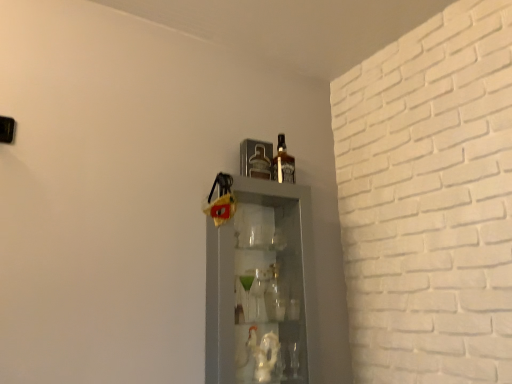
The width and height of the screenshot is (512, 384). Describe the element at coordinates (283, 163) in the screenshot. I see `brown glass bottle at upper center` at that location.

Find the location of `brown glass bottle at upper center`. brown glass bottle at upper center is located at coordinates (283, 163).

Measure the distance between point (291,166) and camera.

The distance of point (291,166) from camera is 5.89 feet.

What do you see at coordinates (259, 283) in the screenshot? I see `clear glass cabinet at center` at bounding box center [259, 283].

Identify the location of clear glass cabinet at center. (259, 283).

Locate an element on the screen. This screenshot has width=512, height=384. brown glass bottle at upper center is located at coordinates (283, 163).

Is clear glass cabinet at center to the left or to the right of brown glass bottle at upper center in the image?

In the image, clear glass cabinet at center appears on the left side of brown glass bottle at upper center.

Who is more distant, clear glass cabinet at center or brown glass bottle at upper center?

brown glass bottle at upper center.

Which is in front, point (219, 277) or point (280, 161)?

The point (219, 277) is more forward.

From the image's perspective, is clear glass cabinet at center under brown glass bottle at upper center?

Indeed, from the image's perspective, clear glass cabinet at center is shown beneath brown glass bottle at upper center.

From a real-world perspective, which object stands above the other?

From a 3D spatial view, brown glass bottle at upper center is above.

Does clear glass cabinet at center have a greater width compared to brown glass bottle at upper center?

Yes, clear glass cabinet at center is wider than brown glass bottle at upper center.

Does clear glass cabinet at center have a lesser height compared to brown glass bottle at upper center?

In fact, clear glass cabinet at center may be taller than brown glass bottle at upper center.

Which of these two, clear glass cabinet at center or brown glass bottle at upper center, is smaller?

brown glass bottle at upper center is smaller.

Can we say clear glass cabinet at center lies outside brown glass bottle at upper center?

Yes, clear glass cabinet at center is outside of brown glass bottle at upper center.

Can you see clear glass cabinet at center touching brown glass bottle at upper center?

No, clear glass cabinet at center is not in contact with brown glass bottle at upper center.

Could you tell me if clear glass cabinet at center is turned towards brown glass bottle at upper center?

No, clear glass cabinet at center is not aimed at brown glass bottle at upper center.

Identify the location of shelf below the brown glass bottle at upper center (from a real-world perspective). Image resolution: width=512 pixels, height=384 pixels. (259, 283).

Can you confirm if brown glass bottle at upper center is positioned to the left of clear glass cabinet at center?

No.

Between brown glass bottle at upper center and clear glass cabinet at center, which one is positioned behind?

brown glass bottle at upper center is behind.

Is point (277, 170) less distant than point (250, 338)?

That is False.

From the image's perspective, which is above, brown glass bottle at upper center or clear glass cabinet at center?

brown glass bottle at upper center, from the image's perspective.

From a real-world perspective, is brown glass bottle at upper center physically located above or below clear glass cabinet at center?

brown glass bottle at upper center is above clear glass cabinet at center.

Does brown glass bottle at upper center have a lesser width compared to clear glass cabinet at center?

Indeed, brown glass bottle at upper center has a lesser width compared to clear glass cabinet at center.

From the picture: Considering the sizes of brown glass bottle at upper center and clear glass cabinet at center in the image, is brown glass bottle at upper center taller or shorter than clear glass cabinet at center?

Clearly, brown glass bottle at upper center is shorter compared to clear glass cabinet at center.

Considering the sizes of objects brown glass bottle at upper center and clear glass cabinet at center in the image provided, who is smaller, brown glass bottle at upper center or clear glass cabinet at center?

brown glass bottle at upper center.

Is brown glass bottle at upper center inside the boundaries of clear glass cabinet at center, or outside?

brown glass bottle at upper center exists outside the volume of clear glass cabinet at center.

Is the surface of brown glass bottle at upper center in direct contact with clear glass cabinet at center?

They are not placed beside each other.

Is brown glass bottle at upper center facing towards clear glass cabinet at center?

No, brown glass bottle at upper center is not oriented towards clear glass cabinet at center.

Can you tell me how much brown glass bottle at upper center and clear glass cabinet at center differ in facing direction?

2.63 degrees separate the facing orientations of brown glass bottle at upper center and clear glass cabinet at center.

At what (x,y) coordinates should I click in order to perform the action: click on bottle above the clear glass cabinet at center (from a real-world perspective). Please return your answer as a coordinate pair (x, y). The width and height of the screenshot is (512, 384). Looking at the image, I should click on (283, 163).

Locate an element on the screen. bottle that is above the clear glass cabinet at center (from a real-world perspective) is located at coordinates (283, 163).

Where is `bottle lying on the right of clear glass cabinet at center`? bottle lying on the right of clear glass cabinet at center is located at coordinates (283, 163).